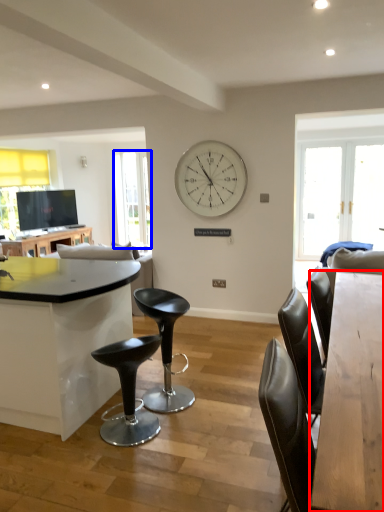
Question: Among these objects, which one is nearest to the camera, table (highlighted by a red box) or window screen (highlighted by a blue box)?

Choices:
 (A) table
 (B) window screen

Answer: (A)